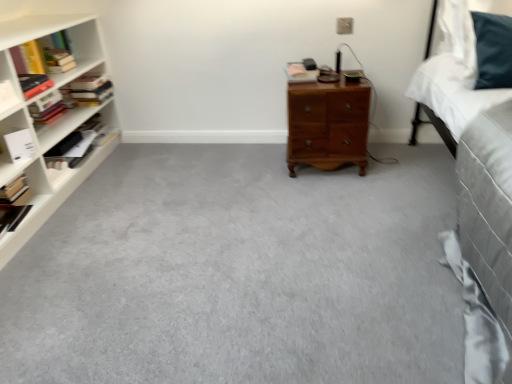
Locate an element on the screen. The width and height of the screenshot is (512, 384). vacant area that is situated to the right of wooden nightstand at center is located at coordinates (395, 159).